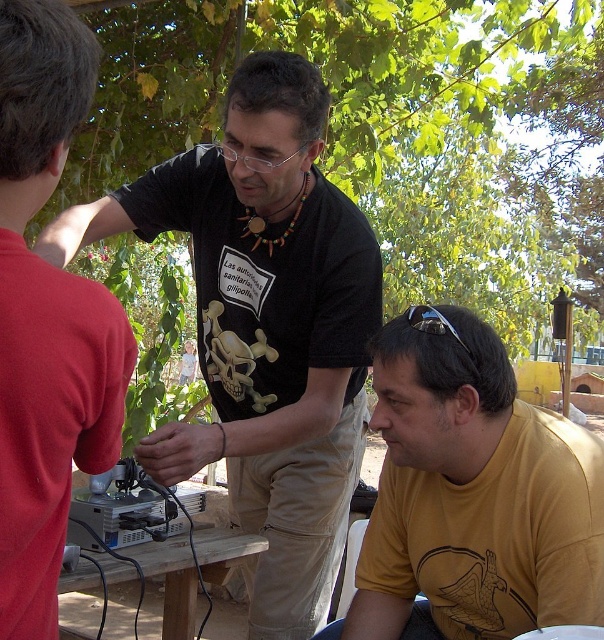
Is point (10, 340) positioned before point (159, 561)?

Yes, point (10, 340) is closer to viewer.

How much distance is there between matte black shirt at center and wooden table at center?

A distance of 32.23 inches exists between matte black shirt at center and wooden table at center.

In order to click on matte black shirt at center in this screenshot , I will do 47,317.

Can you confirm if black matte t-shirt at center is positioned above wooden table at center?

Correct, black matte t-shirt at center is located above wooden table at center.

Is black matte t-shirt at center taller than wooden table at center?

Yes.

Is point (242, 413) closer to viewer compared to point (112, 564)?

No, (242, 413) is further to viewer.

Identify the location of black matte t-shirt at center. (265, 326).

Can you confirm if yellow matte shirt at lower right is positioned to the right of wooden table at center?

Indeed, yellow matte shirt at lower right is positioned on the right side of wooden table at center.

Is yellow matte shirt at lower right thinner than wooden table at center?

No, yellow matte shirt at lower right is not thinner than wooden table at center.

Does point (397, 564) lie behind point (80, 589)?

That is True.

The width and height of the screenshot is (604, 640). Identify the location of yellow matte shirt at lower right. point(472,496).